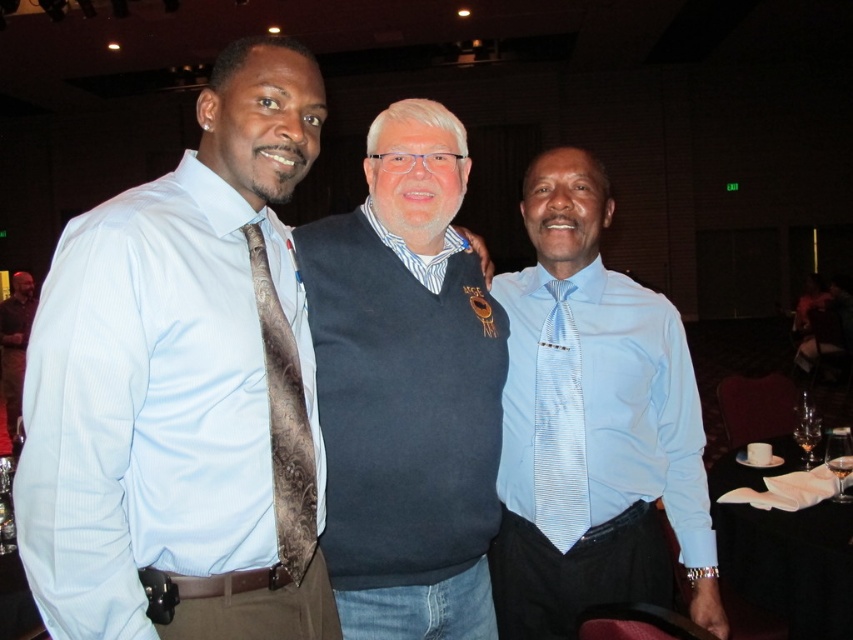
You are a photographer adjusting your camera settings to focus on the light blue striped tie at center and the brown leather jacket at left. Which object should you focus on first to ensure both are in sharp focus?

The light blue striped tie at center is closer to the viewer than the brown leather jacket at left, so focus on the light blue striped tie at center first to ensure both are in sharp focus.

In the image, there are three men standing together. The man on the left is wearing a light blue dress shirt with a patterned tie. The central figure is wearing a dark navy blue sweater vest over a striped collared shirt. Where exactly is the light blue striped tie at center located in terms of coordinates?

The light blue striped tie at center is located at coordinates point [560,426].

You are a photographer at the event and need to ensure that the light blue dress shirt at left and the central figure are in focus simultaneously. Given that your camera has a depth of field that can cover 40 inches, will you be able to capture both subjects clearly?

The light blue dress shirt at left and the central figure are 38.54 inches apart, so yes, the camera can capture both clearly as the distance is within the 40 inches depth of field.